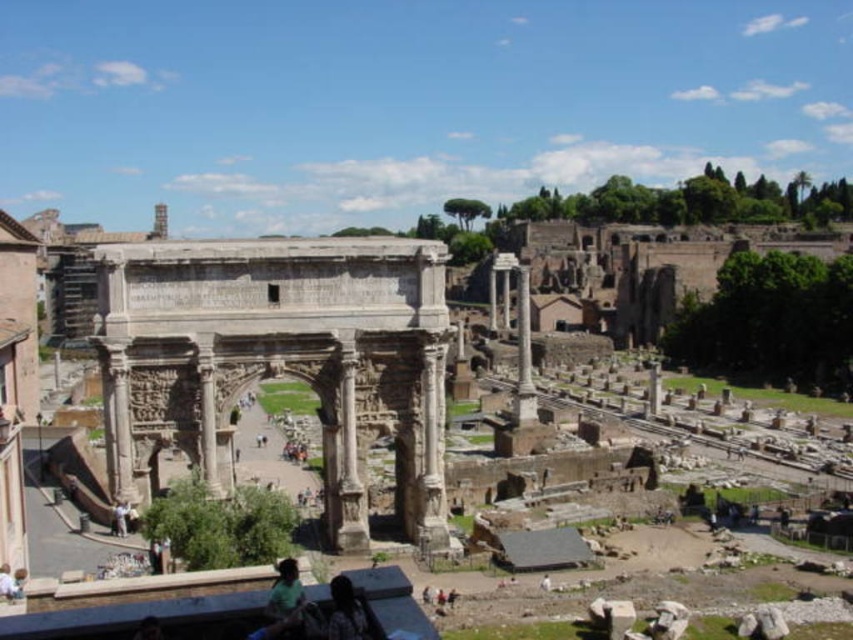
You are standing at the coordinates 0.5, 0.3. You want to reach the stone arch at center. In which direction should you move?

The stone arch at center is located at point (268,355). Since you are at (254,320), you should move northeast to reach it.

You are a tourist visiting the ancient ruins and you see the stone arch at center and the dark hair at lower center. Which object is located above the other?

The stone arch at center is positioned over dark hair at lower center.